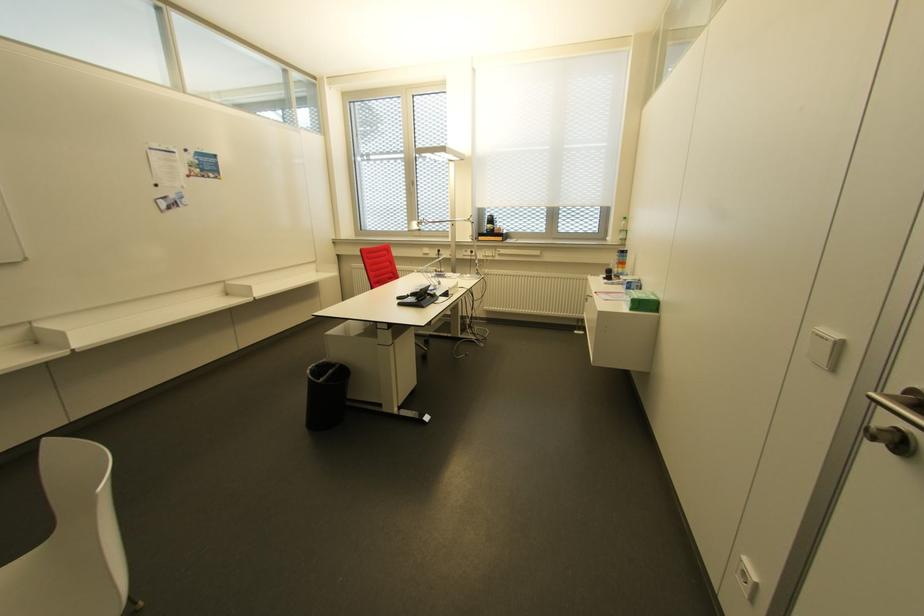
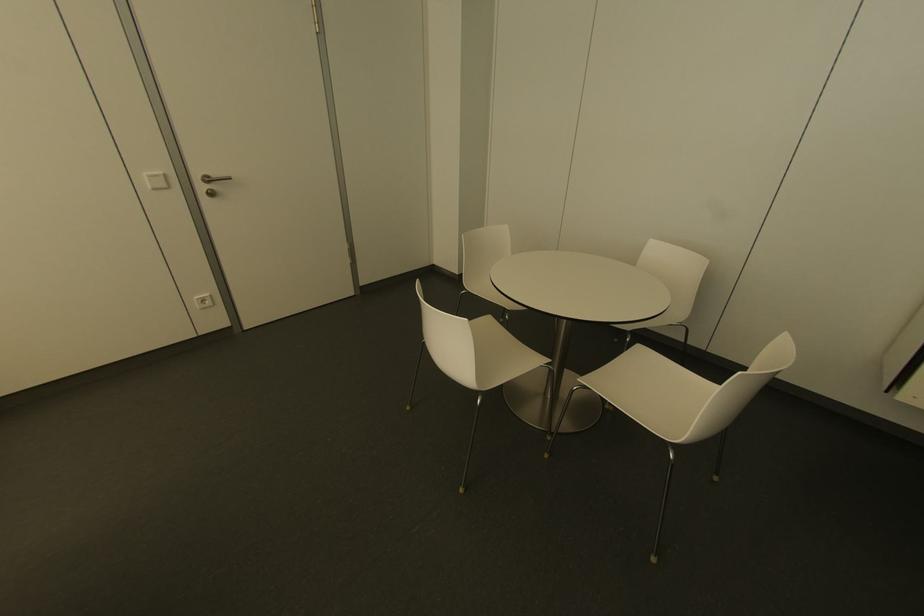
Where in the second image is the point corresponding to point (833, 334) from the first image?

(159, 172)